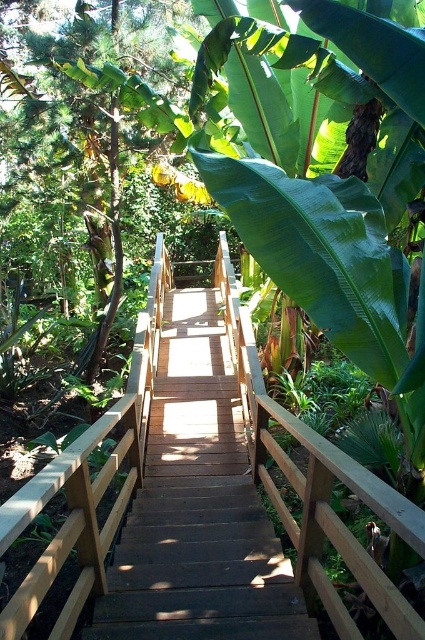
Question: Where is brown wooden stairs at center located in relation to wooden bridge at center in the image?

Choices:
 (A) above
 (B) below

Answer: (B)

Question: Among these points, which one is nearest to the camera?

Choices:
 (A) (166, 483)
 (B) (48, 563)

Answer: (B)

Question: Is the position of brown wooden stairs at center more distant than that of wooden bridge at center?

Choices:
 (A) yes
 (B) no

Answer: (A)

Question: Is brown wooden stairs at center to the right of wooden bridge at center from the viewer's perspective?

Choices:
 (A) yes
 (B) no

Answer: (A)